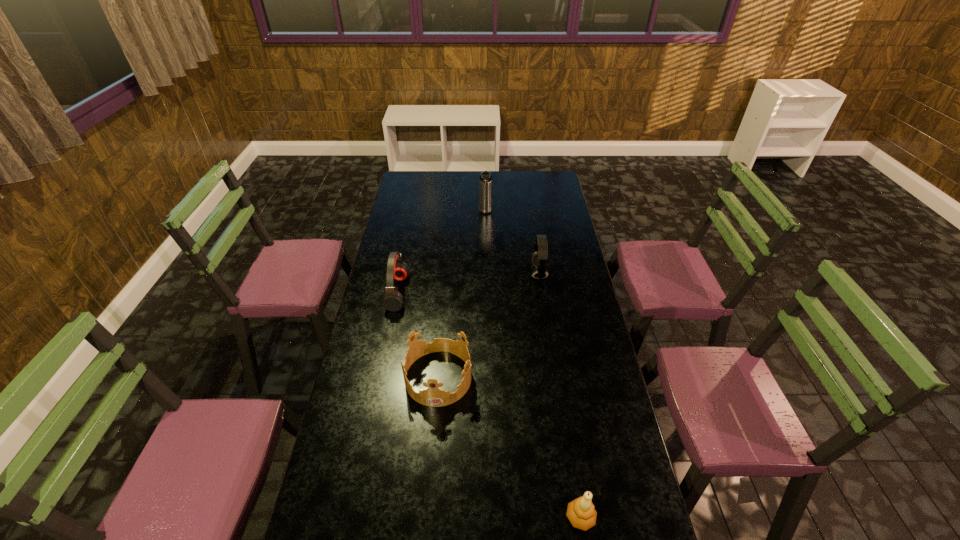
Where is `free spot that satisfies the following two spatial constraints: 1. on the front-facing side of the tiara; 2. on the left side of the nearest object`? The height and width of the screenshot is (540, 960). free spot that satisfies the following two spatial constraints: 1. on the front-facing side of the tiara; 2. on the left side of the nearest object is located at coordinates (426, 517).

I want to click on free spot that satisfies the following two spatial constraints: 1. on the ear cups of the nearest object; 2. on the left side of the leftmost object, so click(352, 517).

This screenshot has height=540, width=960. Identify the location of vacant space that satisfies the following two spatial constraints: 1. on the handle side of the farthest object; 2. on the left side of the nearest object. point(491,517).